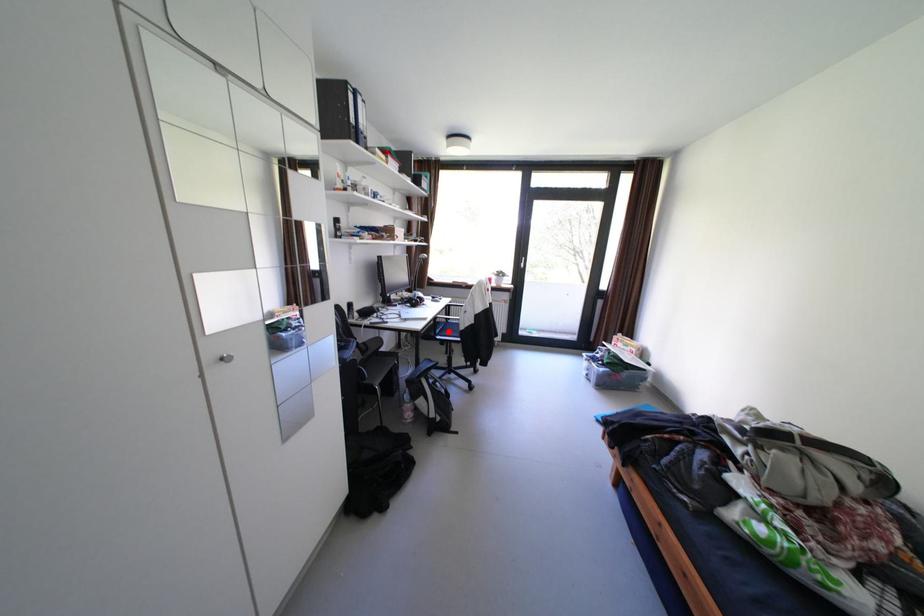
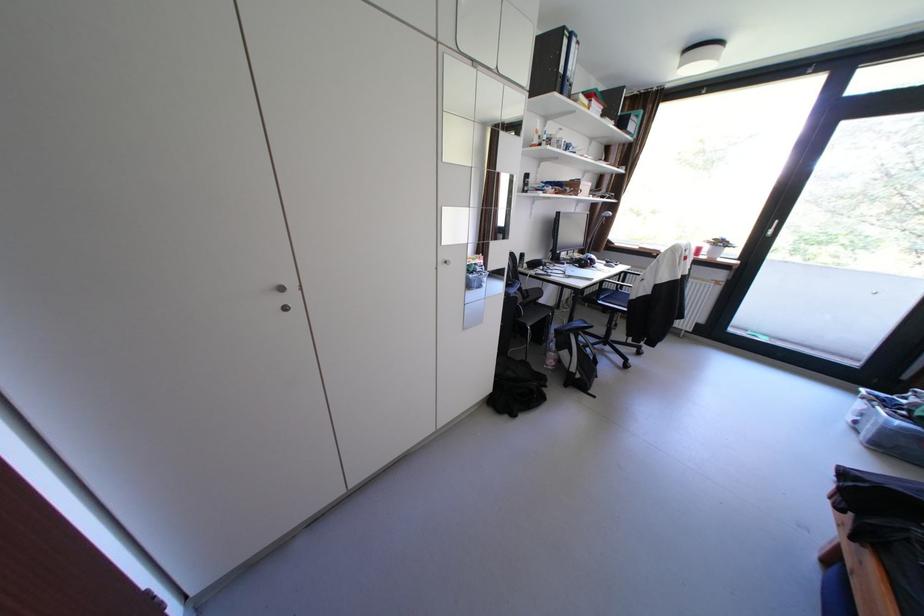
Where in the second image is the point corresponding to the highlighted location from the first image?

(613, 297)